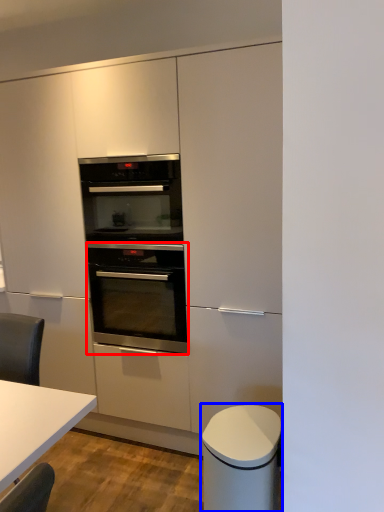
Question: Which object appears farthest to the camera in this image, oven (highlighted by a red box) or cabinetry (highlighted by a blue box)?

Choices:
 (A) oven
 (B) cabinetry

Answer: (A)